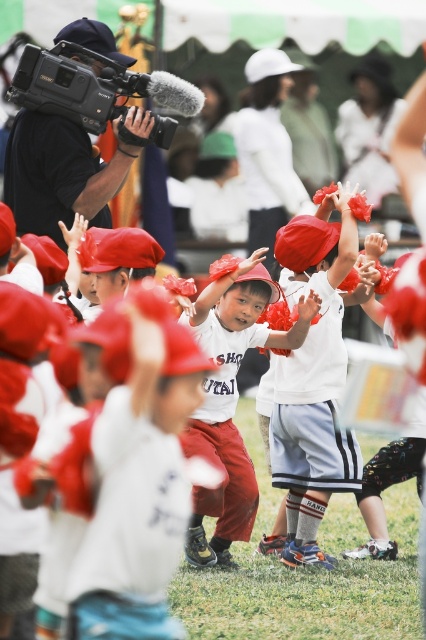
Is white cotton shirt at center to the left of black plastic video camera at upper left from the viewer's perspective?

In fact, white cotton shirt at center is to the right of black plastic video camera at upper left.

Does point (261, 273) come behind point (121, 131)?

No.

Where is `white cotton shirt at center`? This screenshot has height=640, width=426. white cotton shirt at center is located at coordinates (230, 401).

Between white matte shirt at center and black plastic video camera at upper left, which one has less height?

With less height is black plastic video camera at upper left.

Is white matte shirt at center to the right of black plastic video camera at upper left from the viewer's perspective?

Correct, you'll find white matte shirt at center to the right of black plastic video camera at upper left.

The height and width of the screenshot is (640, 426). I want to click on white matte shirt at center, so click(313, 380).

Locate an element on the screen. white matte shirt at center is located at coordinates coord(313,380).

Does matte white shirt at center appear under white matte shirt at center?

Yes, matte white shirt at center is below white matte shirt at center.

What do you see at coordinates (137, 470) in the screenshot? The image size is (426, 640). I see `matte white shirt at center` at bounding box center [137, 470].

Who is more forward, (103, 550) or (328, 458)?

Point (103, 550) is in front.

The height and width of the screenshot is (640, 426). I want to click on matte white shirt at center, so click(x=137, y=470).